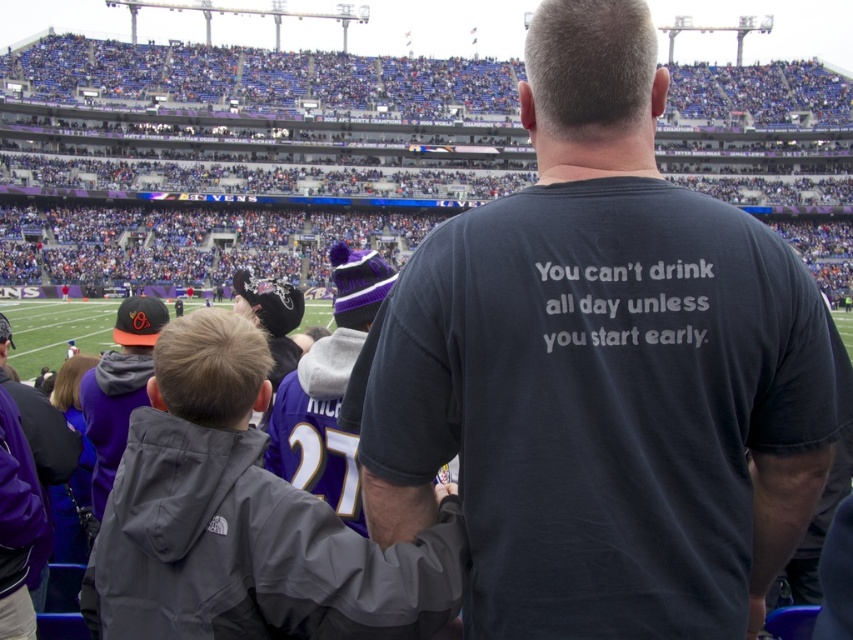
Question: Observing the image, what is the correct spatial positioning of purple knit hat at center in reference to orange matte baseball cap at left?

Choices:
 (A) above
 (B) below

Answer: (A)

Question: Does purple knit hat at center appear over orange matte baseball cap at left?

Choices:
 (A) yes
 (B) no

Answer: (A)

Question: Does dark gray t-shirt at center have a larger size compared to gray fabric jacket at center?

Choices:
 (A) no
 (B) yes

Answer: (B)

Question: Estimate the real-world distances between objects in this image. Which object is closer to the purple knit hat at center?

Choices:
 (A) orange matte baseball cap at left
 (B) gray fabric jacket at center
 (C) dark gray t-shirt at center

Answer: (B)

Question: Which point appears closest to the camera in this image?

Choices:
 (A) (346, 438)
 (B) (578, 532)
 (C) (164, 412)
 (D) (140, 384)

Answer: (B)

Question: Which of the following is the farthest from the observer?

Choices:
 (A) (514, 316)
 (B) (328, 384)

Answer: (B)